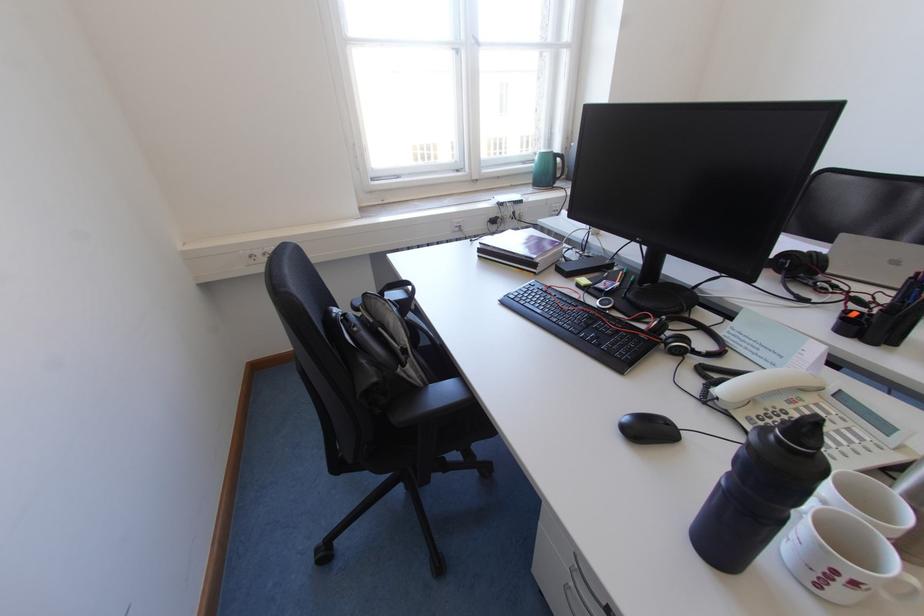
Describe the element at coordinates (767, 383) in the screenshot. I see `the white telephone handset` at that location.